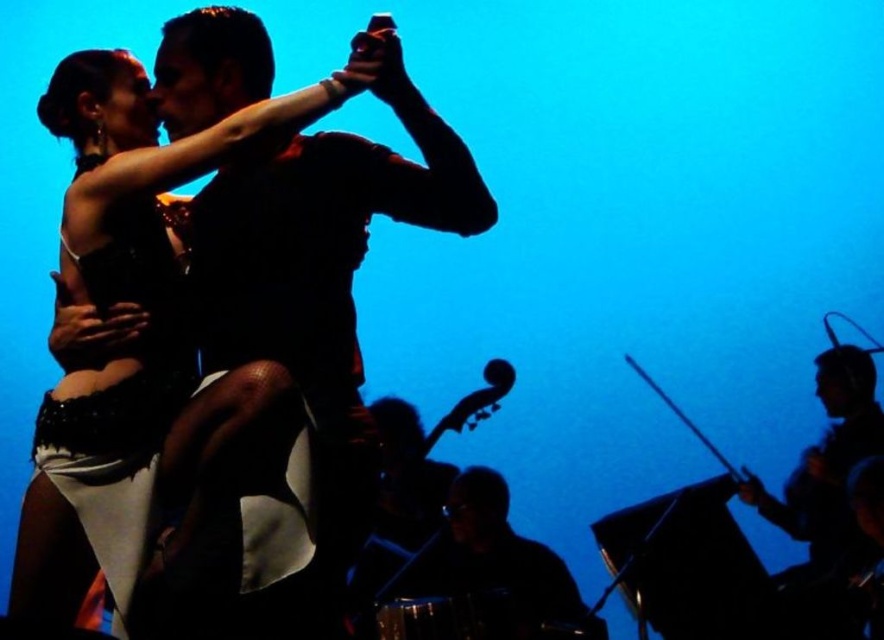
Question: Is shiny black dress at center thinner than silvery metallic drum at lower right?

Choices:
 (A) yes
 (B) no

Answer: (B)

Question: Which point is farther to the camera?

Choices:
 (A) shiny black dress at center
 (B) silvery metallic drum at lower right

Answer: (B)

Question: Can you confirm if shiny black dress at center is bigger than silvery metallic drum at lower right?

Choices:
 (A) no
 (B) yes

Answer: (A)

Question: Can you confirm if shiny black dress at center is bigger than silvery metallic drum at lower right?

Choices:
 (A) yes
 (B) no

Answer: (B)